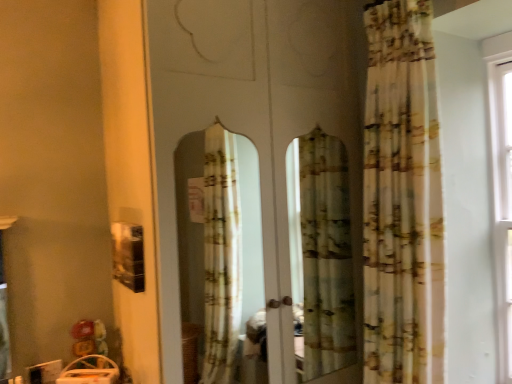
Image resolution: width=512 pixels, height=384 pixels. What do you see at coordinates (401, 196) in the screenshot? I see `printed fabric curtain at right` at bounding box center [401, 196].

In order to face printed fabric curtain at right, should I rotate leftwards or rightwards?

Turn right by 15.874 degrees to look at printed fabric curtain at right.

Where is `printed fabric curtain at right`? Image resolution: width=512 pixels, height=384 pixels. printed fabric curtain at right is located at coordinates click(401, 196).

Describe the element at coordinates (251, 112) in the screenshot. The width and height of the screenshot is (512, 384). I see `transparent glass screen door at center` at that location.

Where is `transparent glass screen door at center`? The height and width of the screenshot is (384, 512). transparent glass screen door at center is located at coordinates (251, 112).

At what (x,y) coordinates should I click in order to perform the action: click on printed fabric curtain at right. Please return your answer as a coordinate pair (x, y). The image size is (512, 384). Looking at the image, I should click on (401, 196).

Which object is positioned more to the right, transparent glass screen door at center or printed fabric curtain at right?

printed fabric curtain at right is more to the right.

Is transparent glass screen door at center in front of or behind printed fabric curtain at right in the image?

Visually, transparent glass screen door at center is located in front of printed fabric curtain at right.

Between point (328, 2) and point (406, 355), which one is positioned behind?

The point (328, 2) is behind.

Consider the image. From the image's perspective, would you say transparent glass screen door at center is shown under printed fabric curtain at right?

Indeed, from the image's perspective, transparent glass screen door at center is shown beneath printed fabric curtain at right.

From a real-world perspective, is transparent glass screen door at center above or below printed fabric curtain at right?

transparent glass screen door at center is situated lower than printed fabric curtain at right in the real world.

Consider the image. Considering the relative sizes of transparent glass screen door at center and printed fabric curtain at right in the image provided, is transparent glass screen door at center thinner than printed fabric curtain at right?

In fact, transparent glass screen door at center might be wider than printed fabric curtain at right.

Which of these two, transparent glass screen door at center or printed fabric curtain at right, stands taller?

transparent glass screen door at center is taller.

Which of these two, transparent glass screen door at center or printed fabric curtain at right, is bigger?

Bigger between the two is transparent glass screen door at center.

Do you think transparent glass screen door at center is within printed fabric curtain at right, or outside of it?

transparent glass screen door at center is not enclosed by printed fabric curtain at right.

Is transparent glass screen door at center beside printed fabric curtain at right?

No, transparent glass screen door at center is not next to printed fabric curtain at right.

Is transparent glass screen door at center facing towards printed fabric curtain at right?

Yes, transparent glass screen door at center is turned towards printed fabric curtain at right.

How many degrees apart are the facing directions of transparent glass screen door at center and printed fabric curtain at right?

89.6 degrees.

The height and width of the screenshot is (384, 512). In order to click on screen door that is below the printed fabric curtain at right (from the image's perspective) in this screenshot , I will do `click(251, 112)`.

Between printed fabric curtain at right and transparent glass screen door at center, which one appears on the right side from the viewer's perspective?

From the viewer's perspective, printed fabric curtain at right appears more on the right side.

Who is more distant, printed fabric curtain at right or transparent glass screen door at center?

printed fabric curtain at right is more distant.

Is point (362, 196) positioned after point (174, 381)?

Yes, it is behind point (174, 381).

From the image's perspective, would you say printed fabric curtain at right is shown under transparent glass screen door at center?

No.

From a real-world perspective, which is physically below, printed fabric curtain at right or transparent glass screen door at center?

transparent glass screen door at center, from a real-world perspective.

Between printed fabric curtain at right and transparent glass screen door at center, which one has larger width?

With larger width is transparent glass screen door at center.

Between printed fabric curtain at right and transparent glass screen door at center, which one has less height?

printed fabric curtain at right.

Which of these two, printed fabric curtain at right or transparent glass screen door at center, is bigger?

transparent glass screen door at center is bigger.

Is printed fabric curtain at right not within transparent glass screen door at center?

That's correct, printed fabric curtain at right is outside of transparent glass screen door at center.

Are printed fabric curtain at right and transparent glass screen door at center making contact?

There is a gap between printed fabric curtain at right and transparent glass screen door at center.

Could you tell me if printed fabric curtain at right is facing transparent glass screen door at center?

No, printed fabric curtain at right does not turn towards transparent glass screen door at center.

Identify the location of curtain above the transparent glass screen door at center (from the image's perspective). pos(401,196).

The image size is (512, 384). Identify the location of screen door that is in front of the printed fabric curtain at right. (251, 112).

You are a GUI agent. You are given a task and a screenshot of the screen. Output one action in this format:
    pyautogui.click(x=<x>, y=<y>)
    Task: Click on the curtain above the transparent glass screen door at center (from a real-world perspective)
    The image size is (512, 384).
    Given the screenshot: What is the action you would take?
    [x=401, y=196]